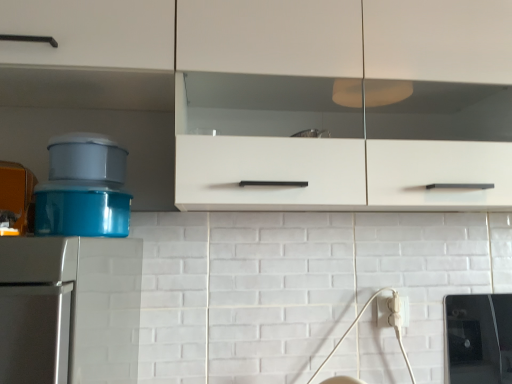
Question: From a real-world perspective, is white plastic electric outlet at lower right above or below white matte cabinet at upper center?

Choices:
 (A) below
 (B) above

Answer: (A)

Question: Looking at their shapes, would you say white plastic electric outlet at lower right is wider or thinner than white matte cabinet at upper center?

Choices:
 (A) wide
 (B) thin

Answer: (B)

Question: Is white plastic electric outlet at lower right in front of or behind white matte cabinet at upper center in the image?

Choices:
 (A) behind
 (B) front

Answer: (A)

Question: In the image, is white matte cabinet at upper center positioned in front of or behind white plastic electric outlet at lower right?

Choices:
 (A) behind
 (B) front

Answer: (B)

Question: Would you say white matte cabinet at upper center is inside or outside white plastic electric outlet at lower right?

Choices:
 (A) inside
 (B) outside

Answer: (B)

Question: Is white matte cabinet at upper center taller or shorter than white plastic electric outlet at lower right?

Choices:
 (A) tall
 (B) short

Answer: (A)

Question: From a real-world perspective, is white matte cabinet at upper center above or below white plastic electric outlet at lower right?

Choices:
 (A) below
 (B) above

Answer: (B)